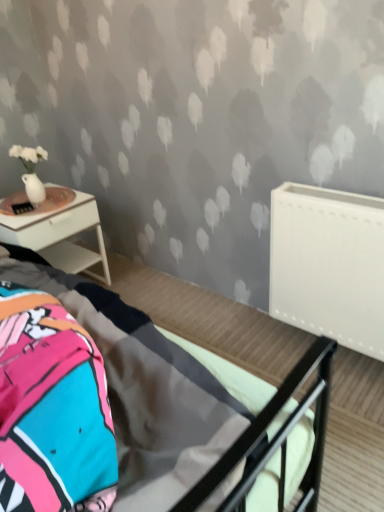
Question: Is metallic gray bed at center inside the boundaries of white glossy nightstand at left, or outside?

Choices:
 (A) inside
 (B) outside

Answer: (B)

Question: Considering the positions of metallic gray bed at center and white glossy nightstand at left in the image, is metallic gray bed at center bigger or smaller than white glossy nightstand at left?

Choices:
 (A) big
 (B) small

Answer: (A)

Question: Which of these objects is positioned closest to the white matte radiator at right?

Choices:
 (A) metallic gray bed at center
 (B) white glossy nightstand at left

Answer: (A)

Question: Estimate the real-world distances between objects in this image. Which object is farther from the white matte radiator at right?

Choices:
 (A) metallic gray bed at center
 (B) white glossy nightstand at left

Answer: (B)